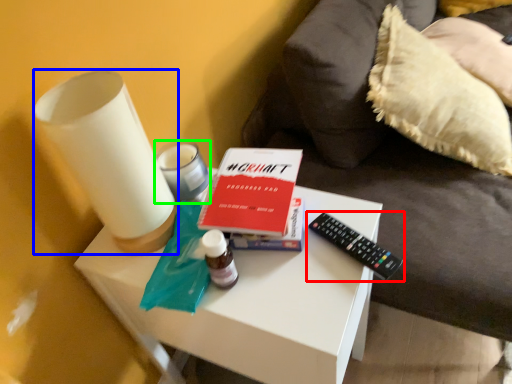
Question: Which object is positioned closest to remote control (highlighted by a red box)? Select from candle holder (highlighted by a blue box) and candle holder (highlighted by a green box).

Choices:
 (A) candle holder
 (B) candle holder

Answer: (B)